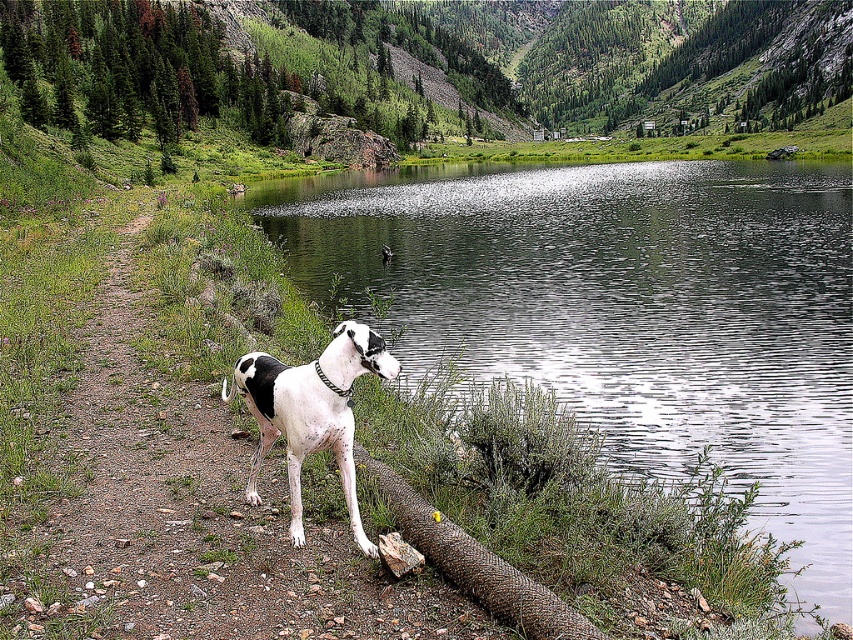
At what (x,y) coordinates should I click in order to perform the action: click on black and white fur at center. Please return your answer as a coordinate pair (x, y). This screenshot has width=853, height=640. Looking at the image, I should click on (311, 412).

Is black and white fur at center positioned at the back of rustic wood log at lower center?

Yes, black and white fur at center is further from the viewer.

This screenshot has width=853, height=640. I want to click on black and white fur at center, so (x=311, y=412).

Image resolution: width=853 pixels, height=640 pixels. I want to click on black and white fur at center, so pos(311,412).

Is clear water at lake left to the left of rustic wood log at lower center from the viewer's perspective?

In fact, clear water at lake left is to the right of rustic wood log at lower center.

Between point (397, 346) and point (450, 541), which one is positioned behind?

Positioned behind is point (397, 346).

Where is `clear water at lake left`? This screenshot has width=853, height=640. clear water at lake left is located at coordinates (622, 310).

Looking at this image, between clear water at lake left and black and white fur at center, which one appears on the right side from the viewer's perspective?

clear water at lake left is more to the right.

Is point (593, 260) closer to viewer compared to point (292, 454)?

No, it is not.

You are a GUI agent. You are given a task and a screenshot of the screen. Output one action in this format:
    pyautogui.click(x=<x>, y=<y>)
    Task: Click on the clear water at lake left
    
    Given the screenshot: What is the action you would take?
    pyautogui.click(x=622, y=310)